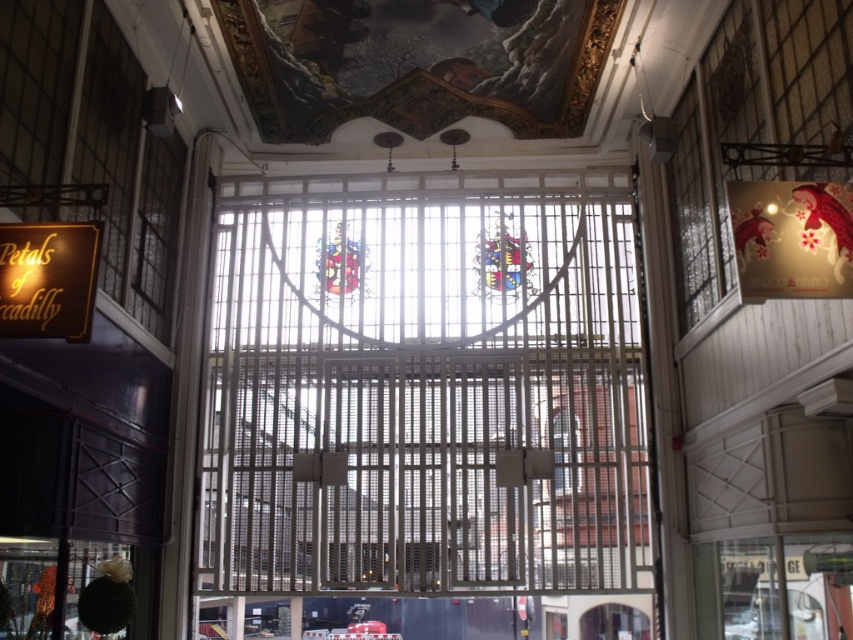
Question: Among these points, which one is nearest to the camera?

Choices:
 (A) (13, 266)
 (B) (285, 326)

Answer: (A)

Question: Is the position of metallic grid at center more distant than that of gold wooden sign at left?

Choices:
 (A) yes
 (B) no

Answer: (A)

Question: Does metallic grid at center appear on the left side of gold wooden sign at left?

Choices:
 (A) yes
 (B) no

Answer: (B)

Question: Among these points, which one is nearest to the camera?

Choices:
 (A) (415, 288)
 (B) (45, 236)

Answer: (B)

Question: Does metallic grid at center have a lesser width compared to gold wooden sign at left?

Choices:
 (A) yes
 (B) no

Answer: (B)

Question: Which object is farther from the camera taking this photo?

Choices:
 (A) gold wooden sign at left
 (B) metallic grid at center

Answer: (B)